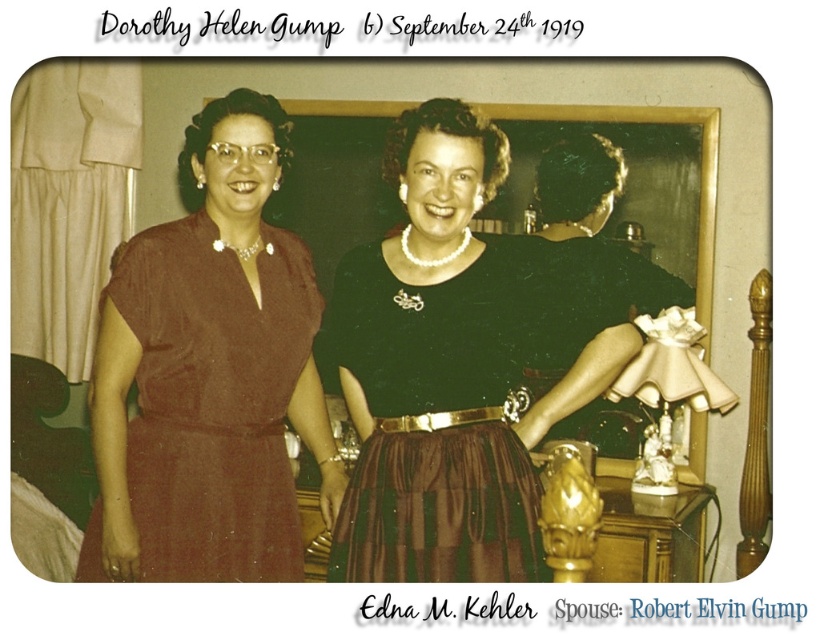
Question: Is black satin dress at center positioned at the back of brown satin dress at left?

Choices:
 (A) yes
 (B) no

Answer: (B)

Question: Can you confirm if black satin dress at center is positioned below brown satin dress at left?

Choices:
 (A) no
 (B) yes

Answer: (A)

Question: Does black satin dress at center have a smaller size compared to brown satin dress at left?

Choices:
 (A) no
 (B) yes

Answer: (A)

Question: Among these points, which one is farthest from the camera?

Choices:
 (A) (153, 316)
 (B) (493, 339)

Answer: (A)